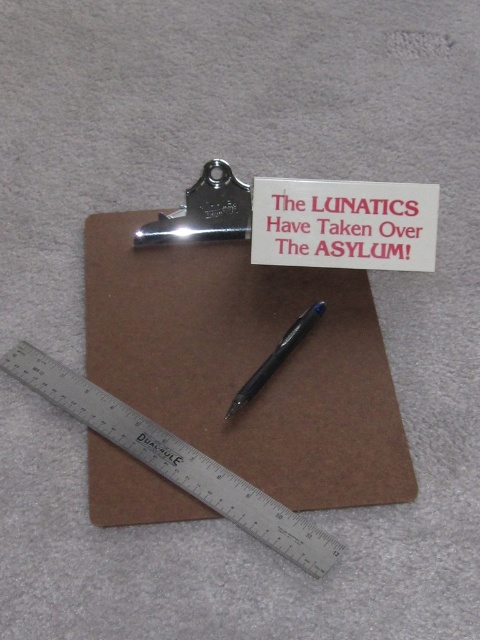
You are organizing a school project and need to determine which ruler is easier to access between the silver metallic ruler at lower left and the brushed metal ruler at lower left. Based on their positions, which ruler can you reach first without moving the other?

The silver metallic ruler at lower left is in front of the brushed metal ruler at lower left, so you can reach the silver metallic ruler at lower left first without moving the other.